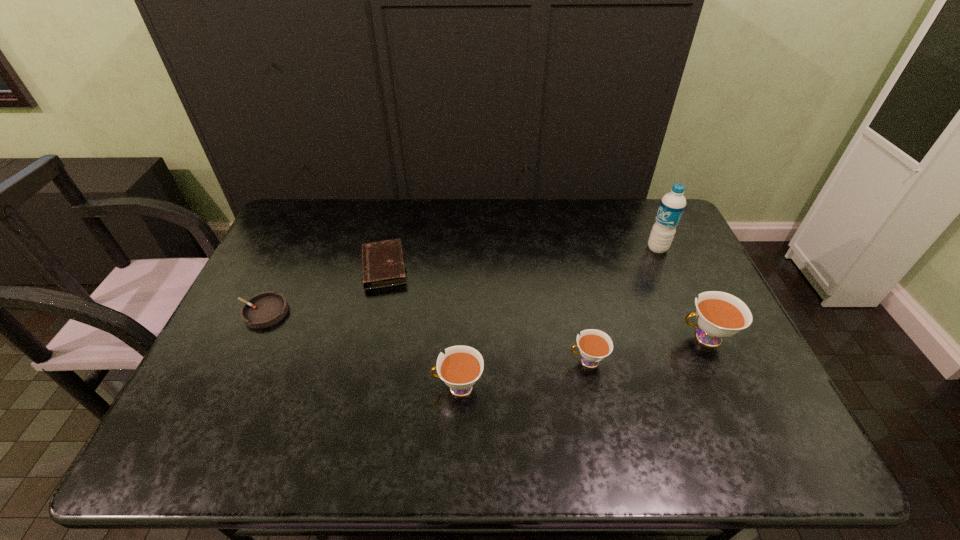
Find the location of a particular element. The height and width of the screenshot is (540, 960). free area in between the fifth shortest object and the leftmost object is located at coordinates (484, 325).

Find the location of a particular element. vacant area that lies between the third tallest object and the diary is located at coordinates (420, 327).

Where is `the fifth closest object to the second tallest object`? Image resolution: width=960 pixels, height=540 pixels. the fifth closest object to the second tallest object is located at coordinates (265, 309).

Identify which object is located as the nearest to the leftmost object. Please provide its 2D coordinates. Your answer should be formatted as a tuple, i.e. [(x, y)], where the tuple contains the x and y coordinates of a point satisfying the conditions above.

[(383, 265)]

Identify which teacup is the closest to the water bottle. Please provide its 2D coordinates. Your answer should be formatted as a tuple, i.e. [(x, y)], where the tuple contains the x and y coordinates of a point satisfying the conditions above.

[(719, 315)]

Identify the location of teacup that can be found as the second closest to the fourth object from right to left. (719, 315).